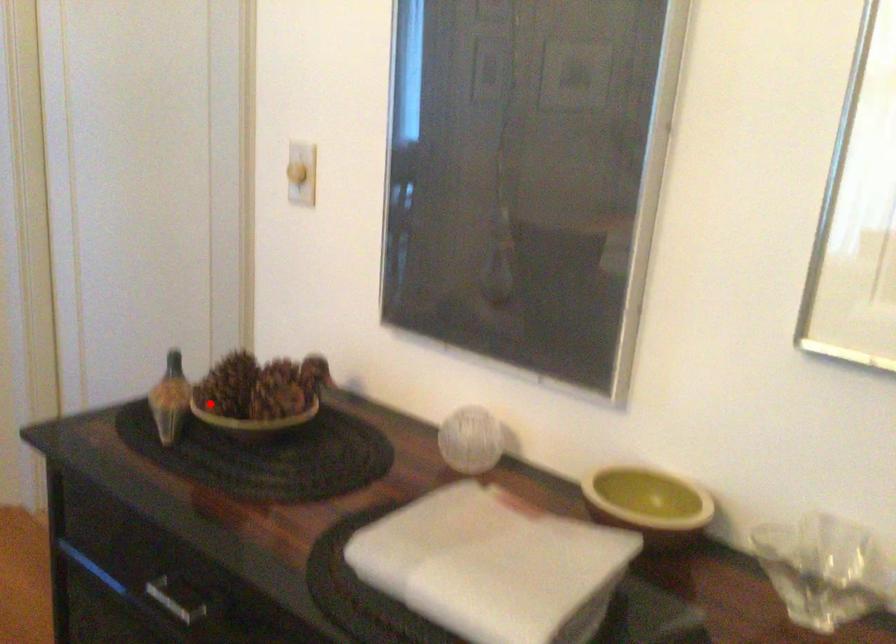
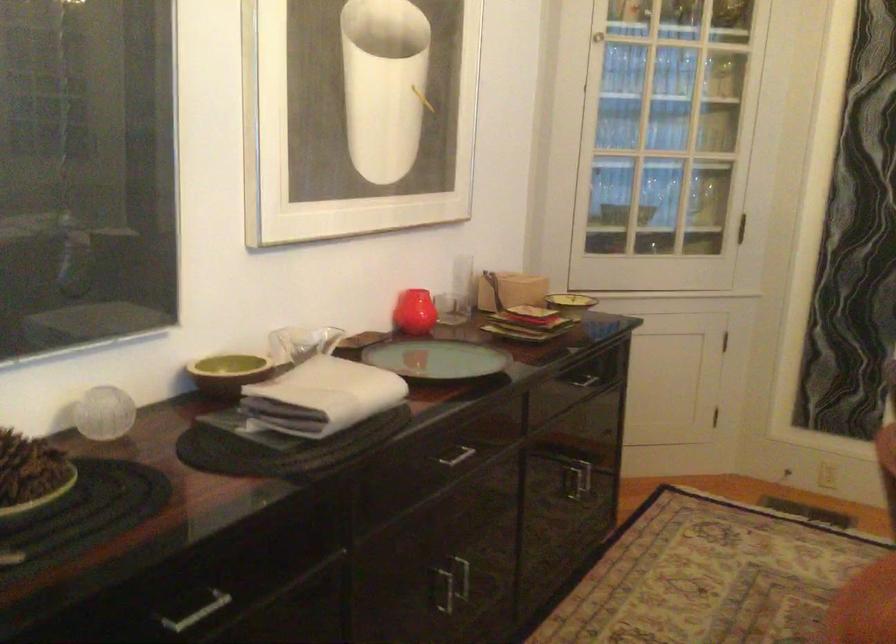
Question: I am providing you with two images of the same scene from different viewpoints. Image1 has a red point marked. In image2, the corresponding 3D location appears at what relative position? Reply with the corresponding letter.

Choices:
 (A) Closer
 (B) Farther

Answer: (A)